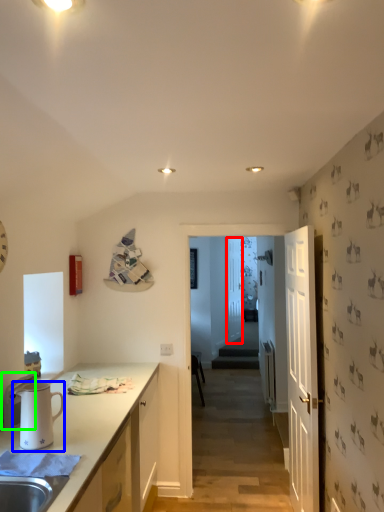
Question: Estimate the real-world distances between objects in this image. Which object is closer to glass door (highlighted by a red box), pitcher (highlighted by a blue box) or appliance (highlighted by a green box)?

Choices:
 (A) pitcher
 (B) appliance

Answer: (B)